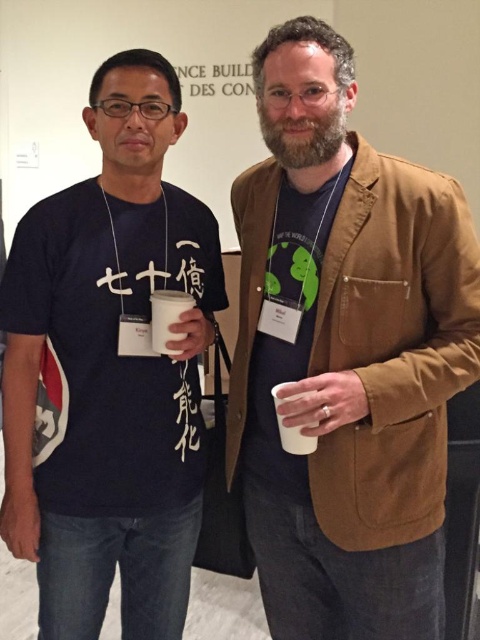
Question: Estimate the real-world distances between objects in this image. Which object is closer to the white matte cup at center?

Choices:
 (A) matte black t-shirt at center
 (B) brown suede blazer at right

Answer: (A)

Question: Is matte black t-shirt at center above white matte cup at center?

Choices:
 (A) no
 (B) yes

Answer: (A)

Question: Is matte black t-shirt at center closer to camera compared to white matte cup at center?

Choices:
 (A) yes
 (B) no

Answer: (B)

Question: Is brown suede blazer at right further to camera compared to matte black t-shirt at center?

Choices:
 (A) no
 (B) yes

Answer: (A)

Question: Which object is closer to the camera taking this photo?

Choices:
 (A) brown suede blazer at right
 (B) matte black t-shirt at center

Answer: (A)

Question: Estimate the real-world distances between objects in this image. Which object is farther from the brown suede blazer at right?

Choices:
 (A) matte black t-shirt at center
 (B) white matte cup at center

Answer: (B)